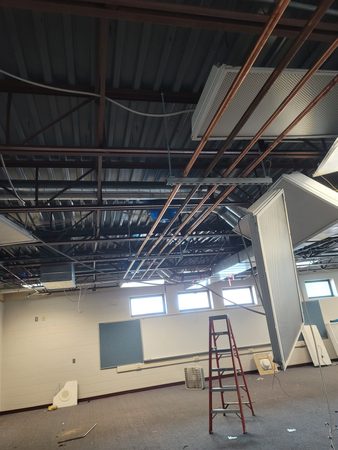
This screenshot has width=338, height=450. What are the coordinates of `windows` in the screenshot? It's located at (141, 303), (184, 299), (235, 294), (315, 288).